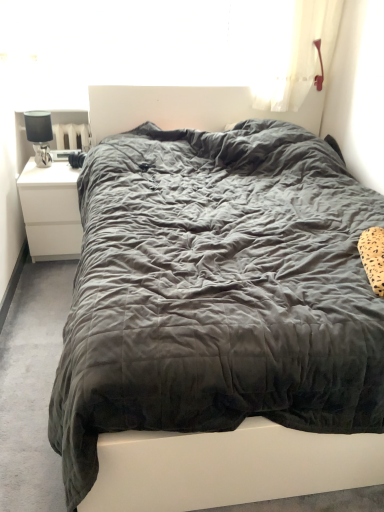
Identify the location of vacant space in front of satin black lamp at left. point(44,175).